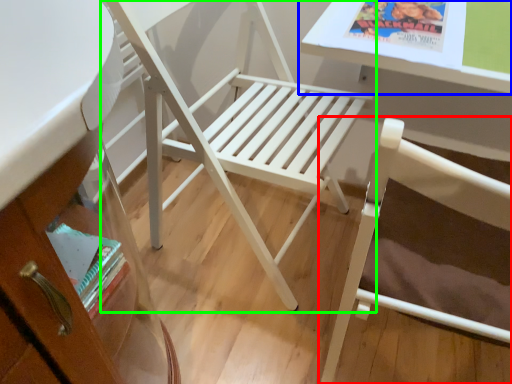
Question: Considering the real-world distances, which object is closest to chair (highlighted by a red box)? table (highlighted by a blue box) or chair (highlighted by a green box).

Choices:
 (A) table
 (B) chair

Answer: (A)